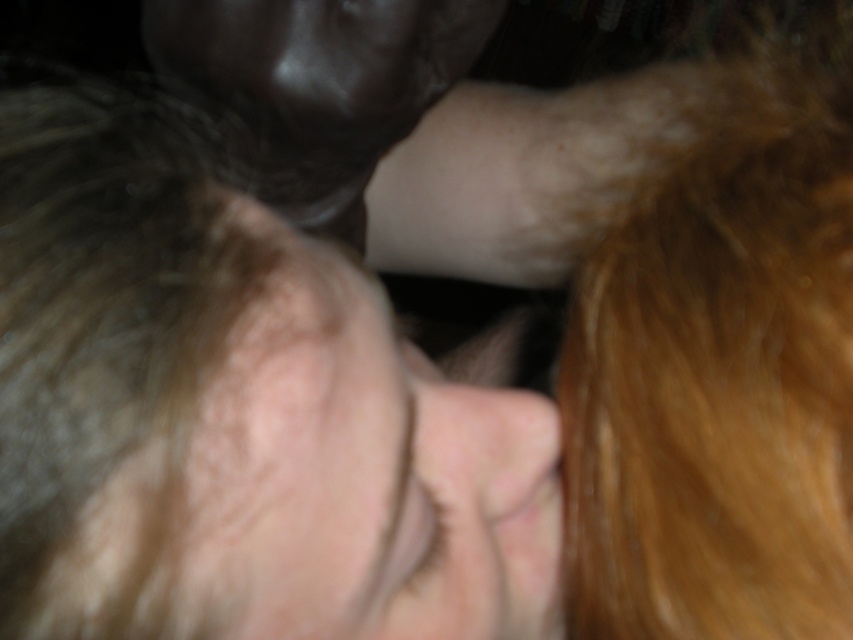
Is blonde silky hair at right thinner than pale skin at center?

No.

Does point (701, 116) come farther from viewer compared to point (224, 595)?

Yes, it is.

This screenshot has width=853, height=640. I want to click on blonde silky hair at right, so click(721, 368).

Who is positioned more to the left, smooth skin face at center or blonde silky hair at right?

From the viewer's perspective, smooth skin face at center appears more on the left side.

Is smooth skin face at center closer to the viewer compared to blonde silky hair at right?

Yes, smooth skin face at center is in front of blonde silky hair at right.

Who is more forward, (15, 342) or (682, 608)?

Point (15, 342)

Where is `smooth skin face at center`? smooth skin face at center is located at coordinates (234, 413).

Describe the element at coordinates (234, 413) in the screenshot. I see `smooth skin face at center` at that location.

Can you confirm if smooth skin face at center is bigger than pale skin at center?

Indeed, smooth skin face at center has a larger size compared to pale skin at center.

Is point (128, 392) closer to camera compared to point (489, 630)?

Yes, it is in front of point (489, 630).

This screenshot has width=853, height=640. I want to click on smooth skin face at center, so tap(234, 413).